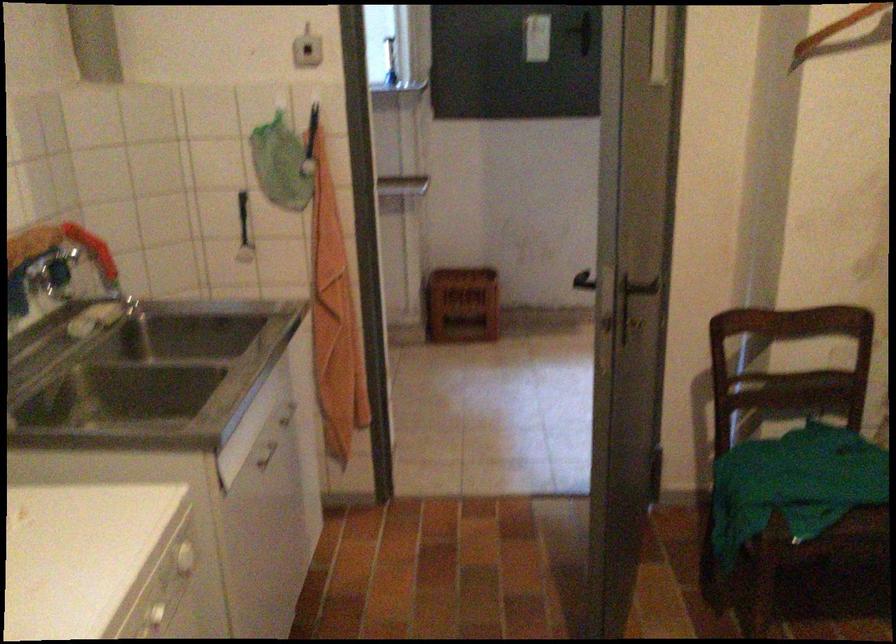
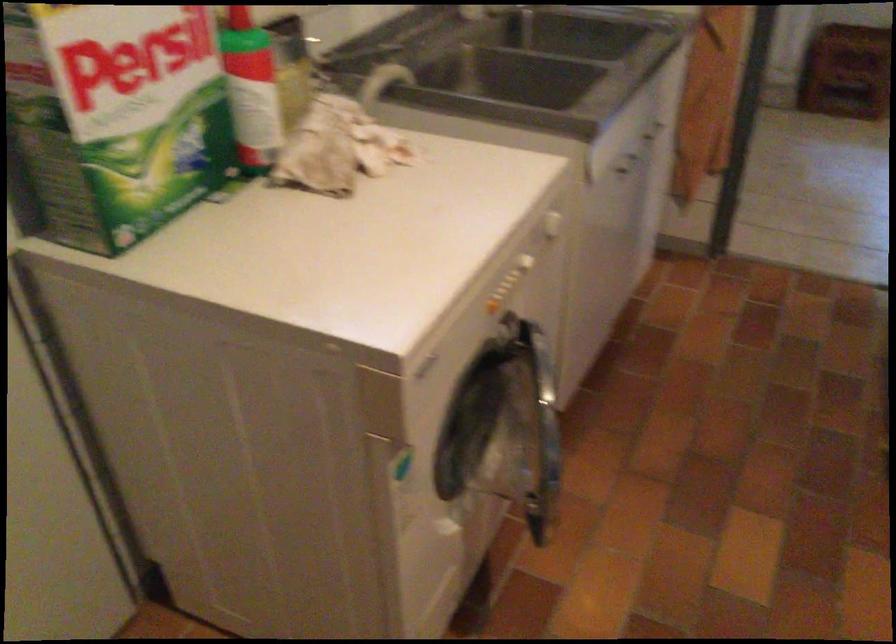
The first image is from the beginning of the video and the second image is from the end. How did the camera likely rotate when shooting the video?

The rotation direction of the camera is left-down.